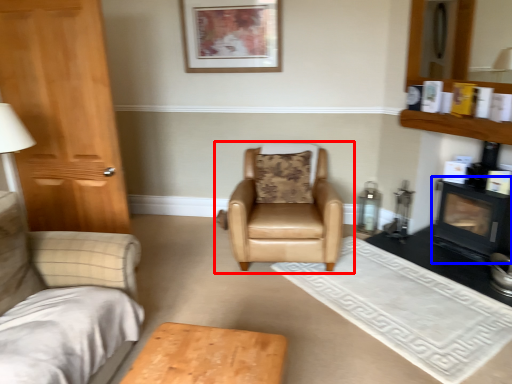
Question: Which point is closer to the camera, chair (highlighted by a red box) or fireplace (highlighted by a blue box)?

Choices:
 (A) chair
 (B) fireplace

Answer: (B)